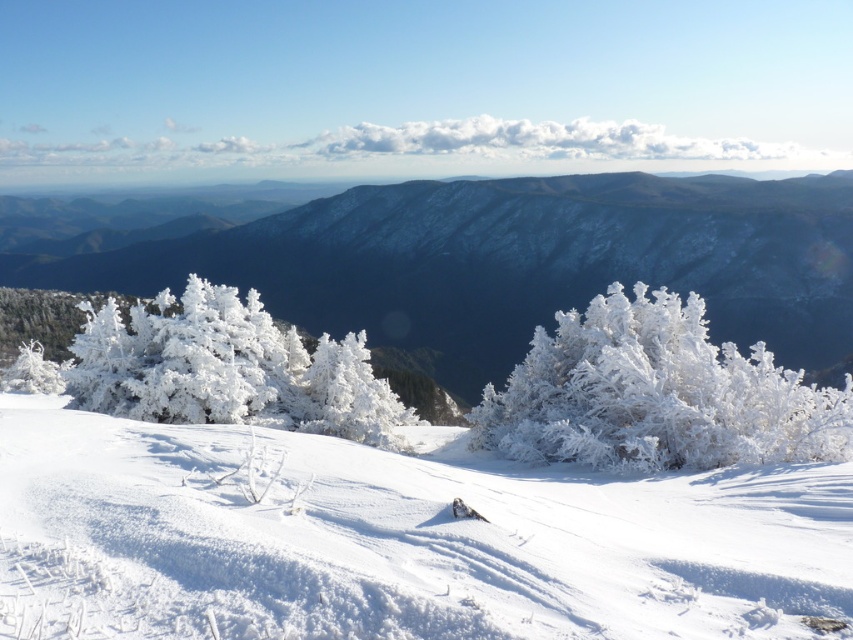
You are standing in the winter landscape and want to take a photo of the white frosty snow at center and the frosted white trees at center. Which object will appear closer to the camera in the photo?

The white frosty snow at center will appear closer to the camera because it is shorter than the frosted white trees at center, making it positioned in the foreground.

You are standing at the center of the winter landscape described. Looking around, you notice a point marked at coordinates (393, 540). What is the terrain feature located at this point?

The point at coordinates (393, 540) indicates white frosty snow at center.

From the picture: You are an observer standing in the winter landscape. You notice the white frosty snow at center and the frosted white bush at center. Which one appears bigger in the scene?

The white frosty snow at center is larger in size than the frosted white bush at center, so the white frosty snow at center appears bigger in the scene.